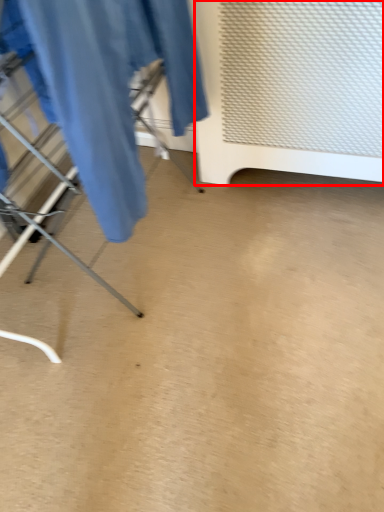
Question: From the image's perspective, what is the correct spatial positioning of furniture (annotated by the red box) in reference to clothing?

Choices:
 (A) below
 (B) above

Answer: (B)